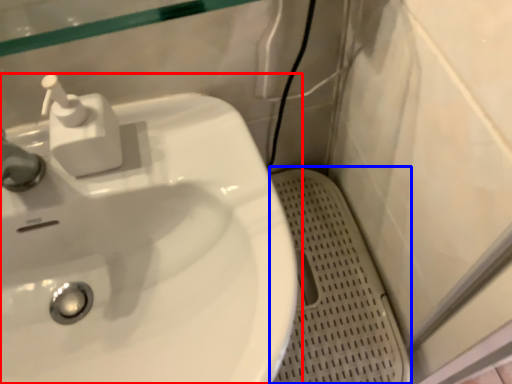
Question: Among these objects, which one is farthest to the camera, sink (highlighted by a red box) or porcelain (highlighted by a blue box)?

Choices:
 (A) sink
 (B) porcelain

Answer: (B)